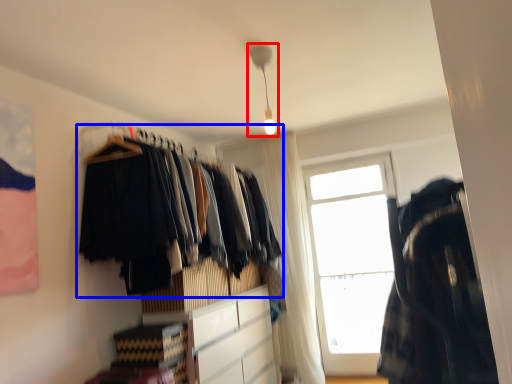
Question: Which object is closer to the camera taking this photo, light fixture (highlighted by a red box) or closet (highlighted by a blue box)?

Choices:
 (A) light fixture
 (B) closet

Answer: (B)